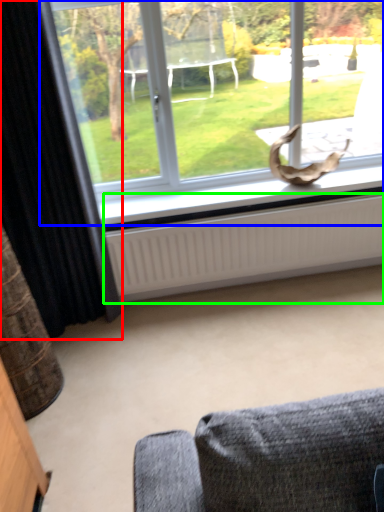
Question: Estimate the real-world distances between objects in this image. Which object is closer to curtain (highlighted by a red box), window (highlighted by a blue box) or radiator (highlighted by a green box)?

Choices:
 (A) window
 (B) radiator

Answer: (B)